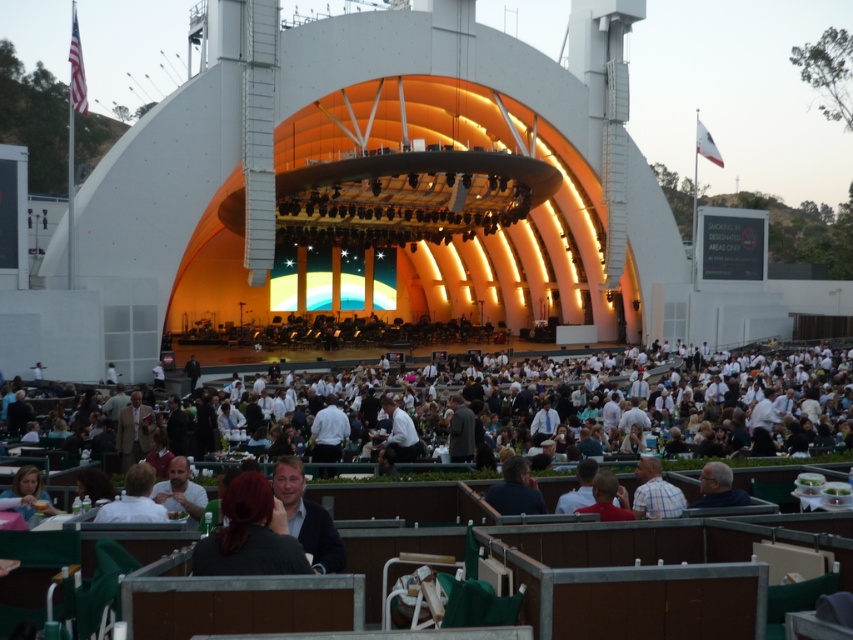
Question: Where is dark brown sweater at lower center located in relation to matte black shirt at center in the image?

Choices:
 (A) left
 (B) right

Answer: (B)

Question: Can you confirm if matte black shirt at center is smaller than white fabric shirt at center?

Choices:
 (A) yes
 (B) no

Answer: (A)

Question: Which point is farther to the camera?

Choices:
 (A) matte black shirt at center
 (B) dark gray sweater at lower center

Answer: (B)

Question: Which object is farther from the camera taking this photo?

Choices:
 (A) dark brown hair at center
 (B) white shirt at lower center
 (C) dark brown sweater at lower center
 (D) blue plaid shirt at center

Answer: (D)

Question: Which point is farther to the camera?

Choices:
 (A) (412, 428)
 (B) (300, 496)
 (C) (517, 476)

Answer: (A)

Question: Where is white shirt at lower center located in relation to white fabric shirt at center in the image?

Choices:
 (A) above
 (B) below

Answer: (A)